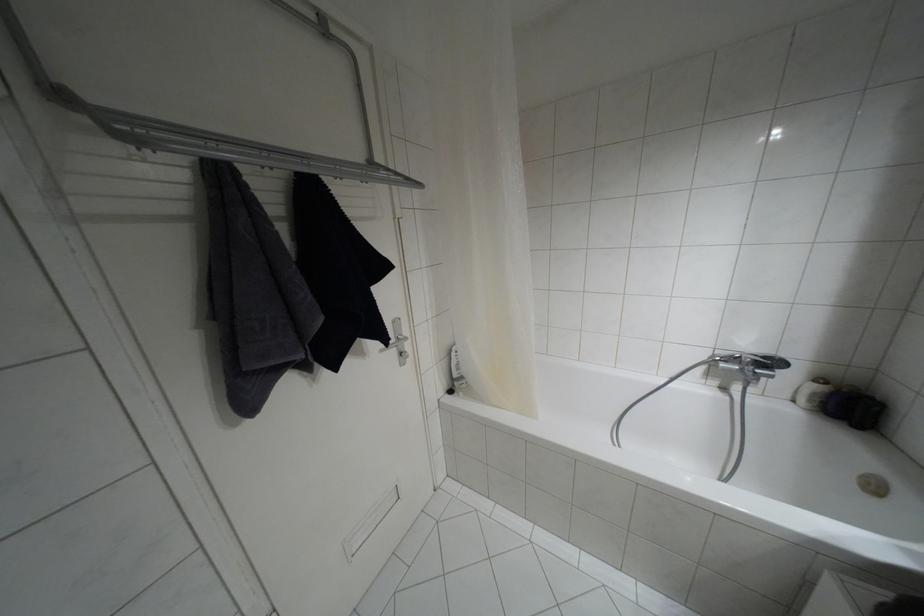
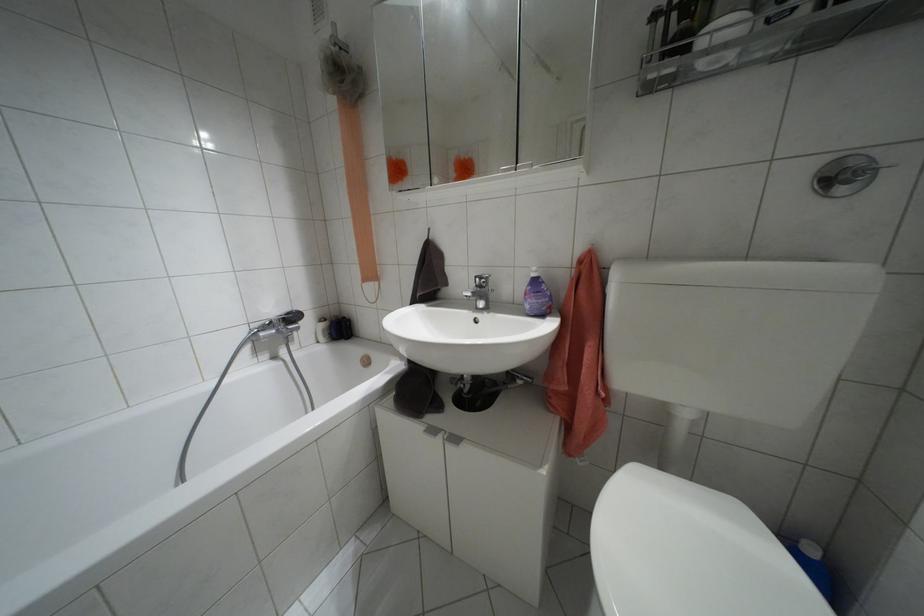
Question: Based on the continuous images, in which direction is the camera rotating? Reply with the corresponding letter.

Choices:
 (A) Left
 (B) Right
 (C) Up
 (D) Down

Answer: (B)